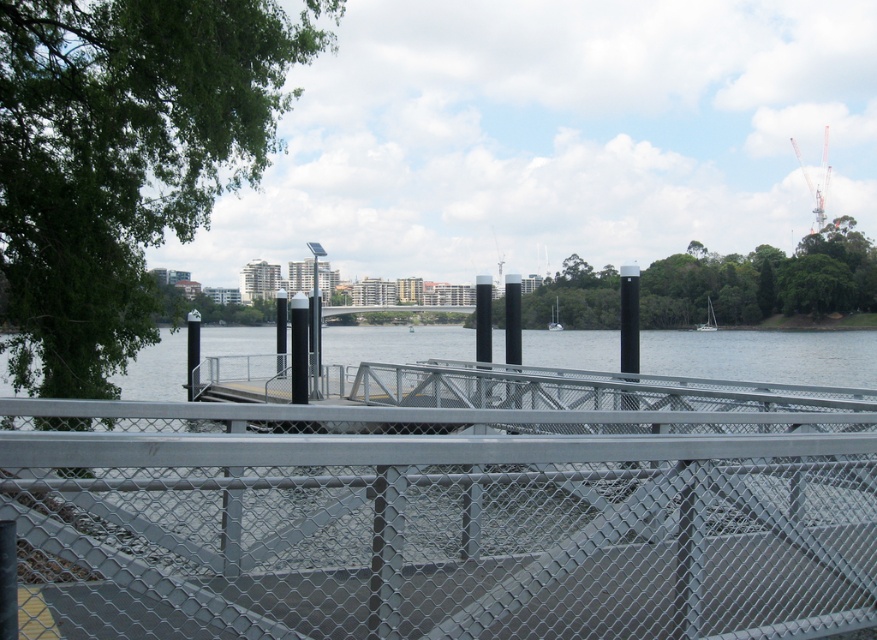
Question: Which object is farther from the camera taking this photo?

Choices:
 (A) white matte sailboat at center
 (B) white glossy sailboat at center

Answer: (B)

Question: Which of the following is the farthest from the observer?

Choices:
 (A) (529, 500)
 (B) (550, 307)

Answer: (B)

Question: Can you confirm if metal mesh fence at center is smaller than white matte sailboat at center?

Choices:
 (A) no
 (B) yes

Answer: (A)

Question: Is metal mesh fence at center to the left of white matte sailboat at center from the viewer's perspective?

Choices:
 (A) yes
 (B) no

Answer: (A)

Question: Can you confirm if metal mesh fence at center is wider than white glossy sailboat at center?

Choices:
 (A) yes
 (B) no

Answer: (A)

Question: Considering the real-world distances, which object is farthest from the metal mesh fence at center?

Choices:
 (A) white matte sailboat at center
 (B) white glossy sailboat at center

Answer: (B)